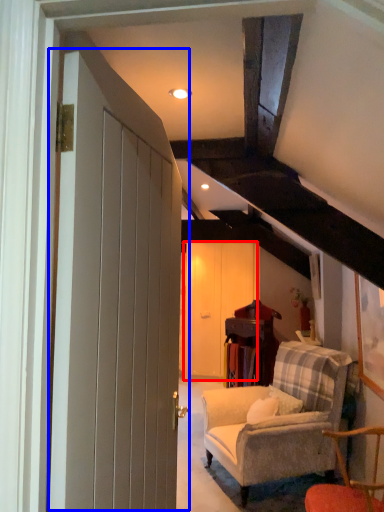
Question: Which object appears farthest to the camera in this image, barn door (highlighted by a red box) or door (highlighted by a blue box)?

Choices:
 (A) barn door
 (B) door

Answer: (A)